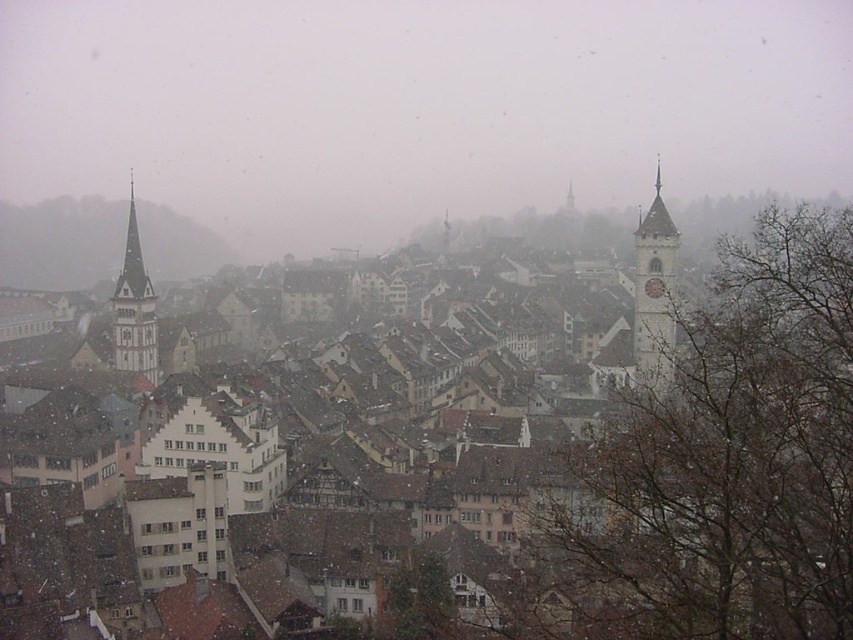
Question: Which point appears closest to the camera in this image?

Choices:
 (A) (677, 456)
 (B) (148, 358)
 (C) (645, 321)

Answer: (A)

Question: Can you confirm if white stone clock tower at right is bigger than white stone bell tower at left?

Choices:
 (A) yes
 (B) no

Answer: (B)

Question: Is white stone clock tower at right wider than white stone bell tower at left?

Choices:
 (A) yes
 (B) no

Answer: (B)

Question: Among these objects, which one is nearest to the camera?

Choices:
 (A) brown tiled roofs at center
 (B) white stone clock tower at right

Answer: (A)

Question: Is white stone clock tower at right positioned at the back of white stone bell tower at left?

Choices:
 (A) yes
 (B) no

Answer: (B)

Question: Which object is closer to the camera taking this photo?

Choices:
 (A) white stone bell tower at left
 (B) brown tiled roofs at center
 (C) white stone clock tower at right

Answer: (B)